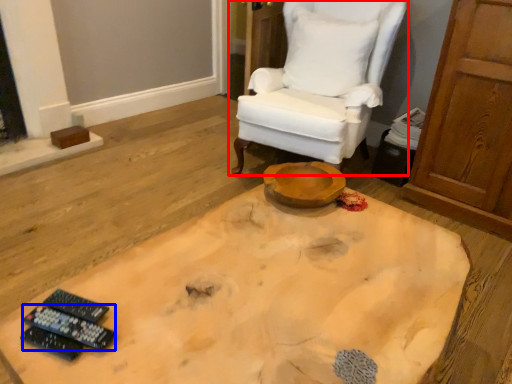
Question: Which of the following is the farthest to the observer, chair (highlighted by a red box) or remote control (highlighted by a blue box)?

Choices:
 (A) chair
 (B) remote control

Answer: (A)